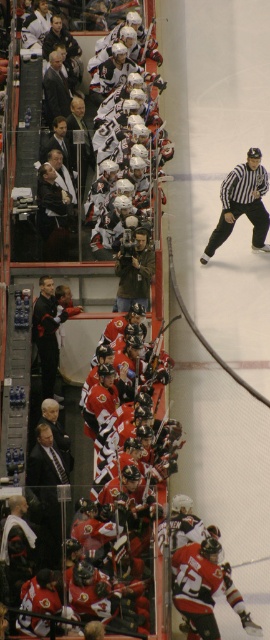
Question: Can you confirm if orange jersey at center is positioned above black jersey at center?

Choices:
 (A) no
 (B) yes

Answer: (A)

Question: Among these objects, which one is nearest to the camera?

Choices:
 (A) black jersey at center
 (B) orange jersey at center

Answer: (B)

Question: Which of the following is the closest to the observer?

Choices:
 (A) black jersey at center
 (B) orange jersey at center

Answer: (B)

Question: Can you confirm if orange jersey at center is smaller than black jersey at center?

Choices:
 (A) yes
 (B) no

Answer: (A)

Question: Does orange jersey at center have a larger size compared to black jersey at center?

Choices:
 (A) no
 (B) yes

Answer: (A)